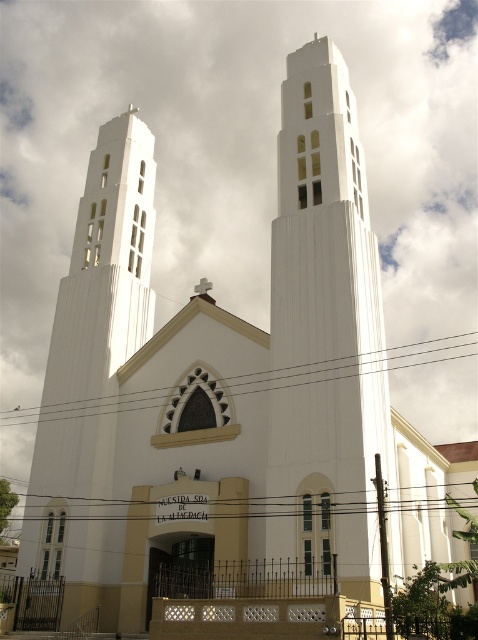
Question: Is white smooth tower at center to the right of white smooth tower at left from the viewer's perspective?

Choices:
 (A) yes
 (B) no

Answer: (A)

Question: Which object appears closest to the camera in this image?

Choices:
 (A) white smooth tower at center
 (B) white smooth tower at left

Answer: (A)

Question: Is white smooth tower at center above white smooth tower at left?

Choices:
 (A) yes
 (B) no

Answer: (A)

Question: Is white smooth tower at center positioned before white smooth tower at left?

Choices:
 (A) yes
 (B) no

Answer: (A)

Question: Which of the following is the farthest from the observer?

Choices:
 (A) 356,193
 (B) 82,221

Answer: (B)